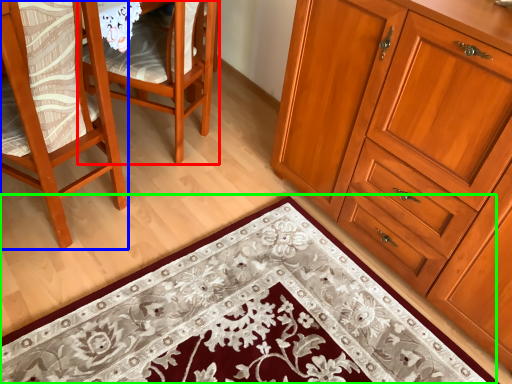
Question: Which object is the farthest from chair (highlighted by a red box)? Choose among these: chair (highlighted by a blue box) or doormat (highlighted by a green box).

Choices:
 (A) chair
 (B) doormat

Answer: (B)